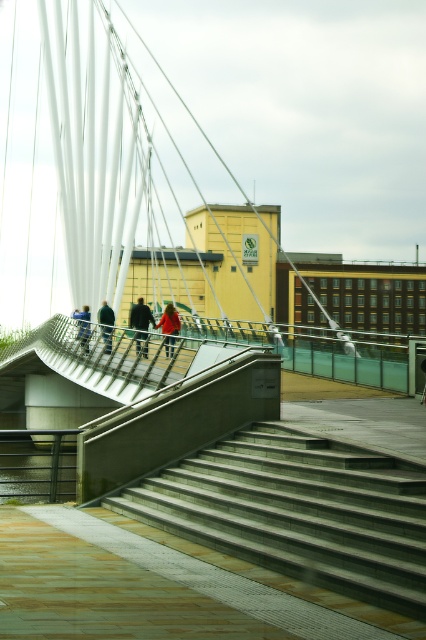
You are standing at the base of the stairs leading to the bridge and want to walk towards the bridge. Which point, point (175, 330) or point (88, 346), will you encounter first?

You will encounter point (175, 330) first because it is in front of point (88, 346) along your path towards the bridge.